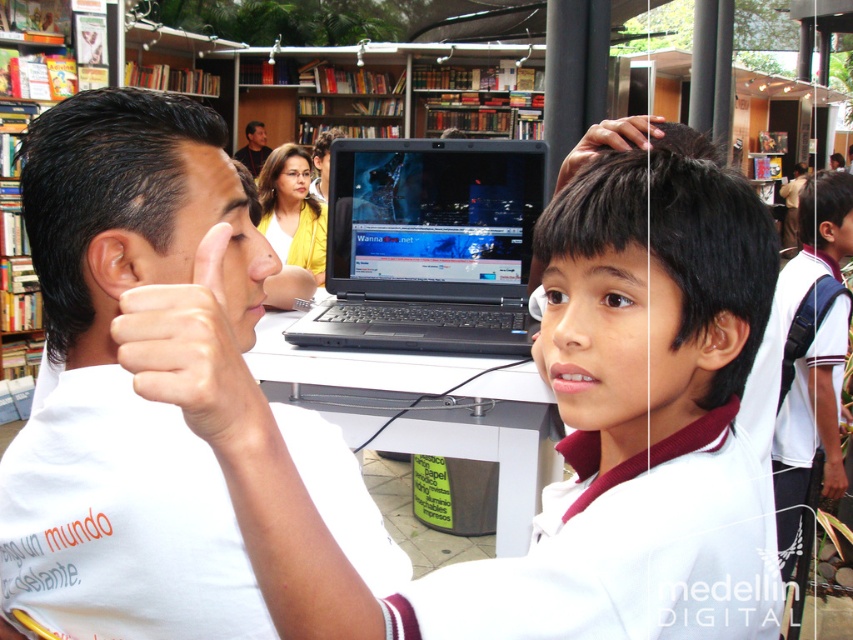
Question: Estimate the real-world distances between objects in this image. Which object is farther from the dark brown hair at upper center?

Choices:
 (A) white uniform shirt at center
 (B) skinny flesh-toned hand at center
 (C) matte black laptop at upper center

Answer: (C)

Question: Among these points, which one is farthest from the camera?

Choices:
 (A) (248, 163)
 (B) (126, 202)
 (C) (567, 168)
 (D) (801, 509)

Answer: (A)

Question: Based on their relative distances, which object is farther from the white uniform shirt at center?

Choices:
 (A) white matte shirt at center
 (B) skinny flesh-toned hand at center
 (C) dark brown hair at upper center

Answer: (B)

Question: Is dark brown hair at upper center smaller than matte black laptop at upper center?

Choices:
 (A) yes
 (B) no

Answer: (A)

Question: From the image, what is the correct spatial relationship of white matte shirt at center in relation to matte black laptop at upper center?

Choices:
 (A) left
 (B) right

Answer: (B)

Question: Can you confirm if white matte shirt at center is positioned to the left of dark brown hair at upper center?

Choices:
 (A) yes
 (B) no

Answer: (A)